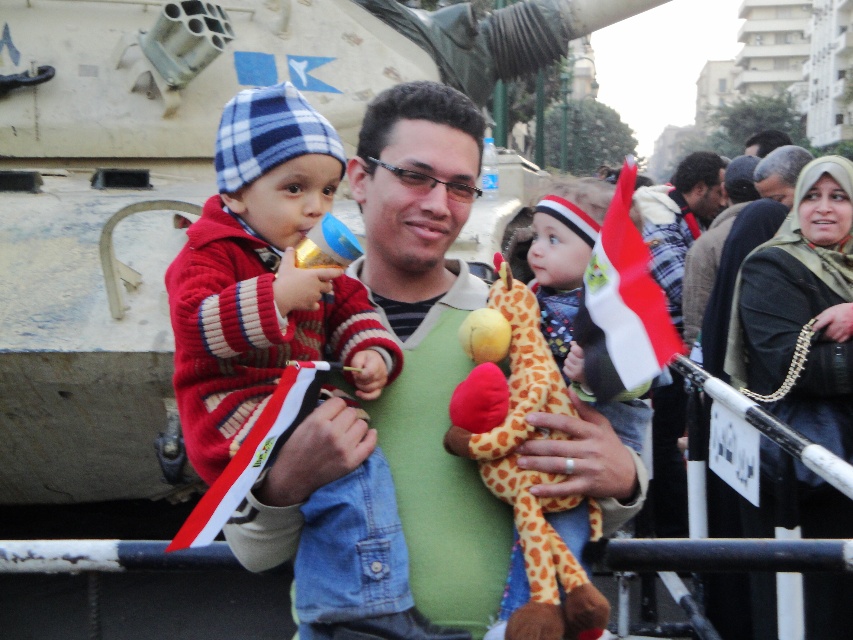
Question: Does red and white striped sweater at center come in front of soft plush giraffe at center?

Choices:
 (A) yes
 (B) no

Answer: (A)

Question: Which point is farther from the camera taking this photo?

Choices:
 (A) (294, 268)
 (B) (537, 481)

Answer: (B)

Question: In this image, where is red and white striped sweater at center located relative to soft plush giraffe at center?

Choices:
 (A) left
 (B) right

Answer: (A)

Question: Which of the following is the farthest from the observer?

Choices:
 (A) (497, 266)
 (B) (294, 106)

Answer: (A)

Question: Which point is closer to the camera?

Choices:
 (A) (548, 358)
 (B) (299, 355)

Answer: (B)

Question: Considering the relative positions of red and white striped sweater at center and soft plush giraffe at center in the image provided, where is red and white striped sweater at center located with respect to soft plush giraffe at center?

Choices:
 (A) right
 (B) left

Answer: (B)